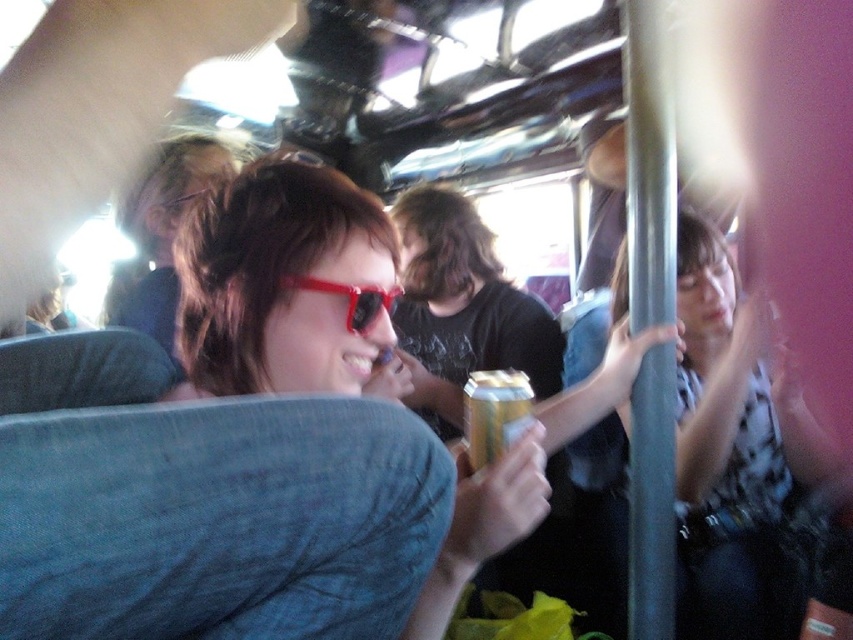
What are the coordinates of the gold foil can at center?

The gold foil can at center is located at coordinates point (494, 413).

You are a passenger on a train and you have a gold foil can at center and transparent plastic sunglasses at center in your bag. You want to place both items on the seat next to you. Since the seat has limited space, which item should you place first to ensure both fit?

The gold foil can at center is thinner than the transparent plastic sunglasses at center, so you should place the transparent plastic sunglasses at center first to accommodate its wider size, then the gold foil can at center will fit beside it.